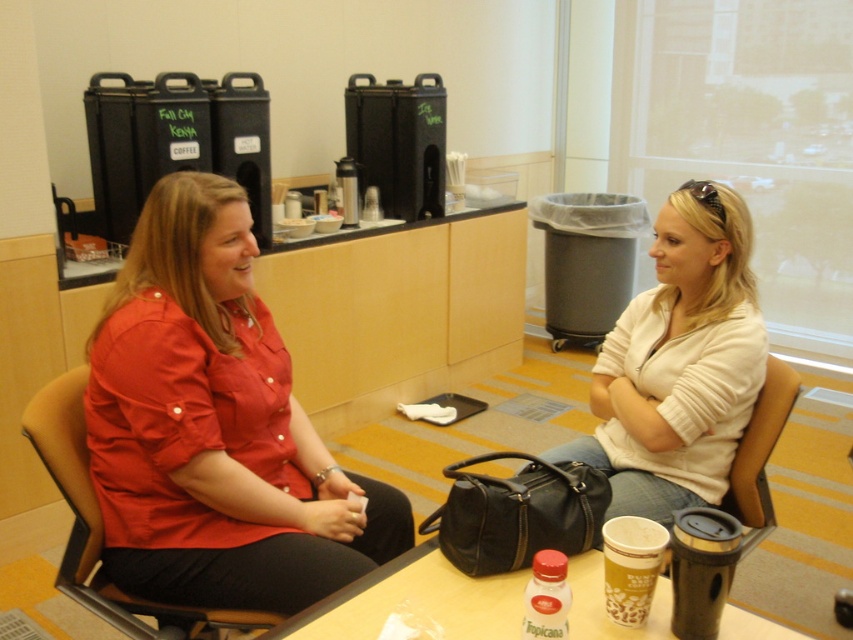
Question: Which of the following is the farthest from the observer?

Choices:
 (A) (653, 531)
 (B) (108, 588)

Answer: (B)

Question: Can you confirm if matte plastic table at center is bigger than leather-like brown chair at lower right?

Choices:
 (A) no
 (B) yes

Answer: (A)

Question: Which point is closer to the camera?

Choices:
 (A) matte red shirt at center
 (B) brown leather chair at left

Answer: (B)

Question: Does matte white blouse at center appear under matte plastic table at center?

Choices:
 (A) yes
 (B) no

Answer: (B)

Question: Which is farther from the leather-like brown chair at lower right?

Choices:
 (A) matte white blouse at center
 (B) brown leather chair at left
 (C) brown paper cup at lower center
 (D) matte red shirt at center

Answer: (B)

Question: Can you confirm if brown leather chair at left is thinner than leather-like brown chair at lower right?

Choices:
 (A) no
 (B) yes

Answer: (A)